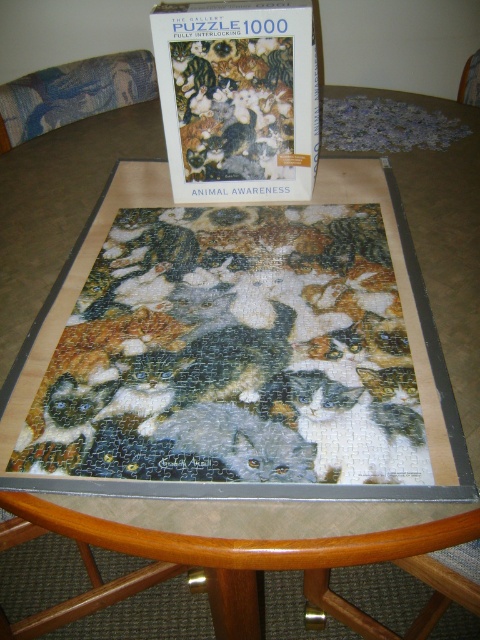
You are organizing a puzzle competition and need to place both the multicolored paper puzzle at center and the matte cardboard puzzle box at upper center on a shelf. The shelf has a width of 1 meter. If the puzzle box is 30 cm wide, can both items fit side by side on the shelf without overlapping?

The multicolored paper puzzle at center is wider than the matte cardboard puzzle box at upper center. Since the puzzle box is 30 cm wide, the puzzle must be wider than 30 cm. Together, their combined width would exceed 1 meter, so they cannot fit side by side on the shelf without overlapping.

You are organizing a puzzle competition and need to place a prize on the table. The prize must be placed on the object that is shorter. Which object should you choose between the multicolored paper puzzle at center and the matte cardboard puzzle box at upper center?

The matte cardboard puzzle box at upper center is shorter than the multicolored paper puzzle at center, so you should place the prize on the matte cardboard puzzle box at upper center.